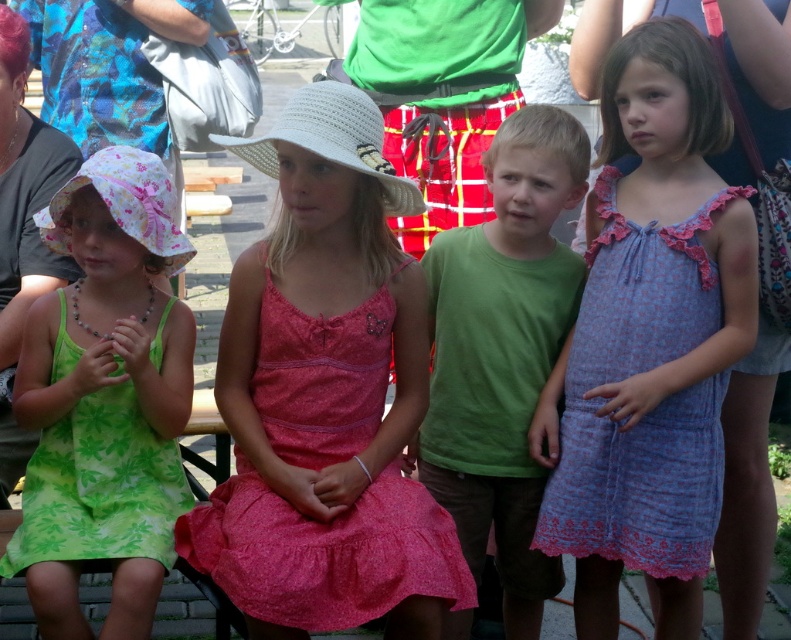
Based on the photo, you are a photographer trying to capture a photo of the children. You notice the green cotton shirt at center and the blue floral fabric dress at right. Which clothing item should you focus on if you want to include both in the frame without moving the camera?

The green cotton shirt at center is below the blue floral fabric dress at right, so focusing on the green cotton shirt at center would allow both items to be in the frame since it is positioned lower than the dress.

You are organizing a clothing donation drive and need to sort items by size. You have a green cotton shirt at center and a green floral fabric dress at left. Which item should you place in the large size bin?

The green cotton shirt at center is larger in size than the green floral fabric dress at left, so it should be placed in the large size bin.